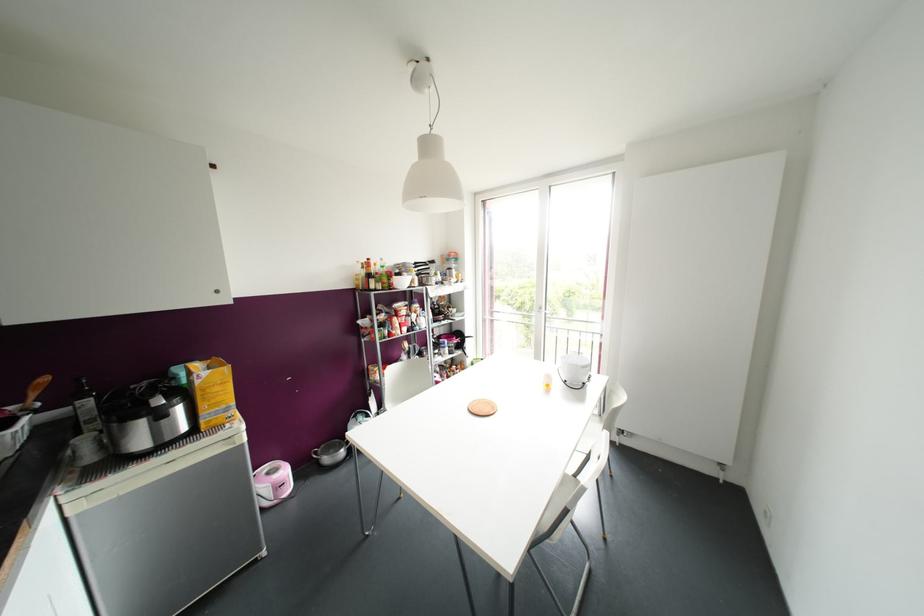
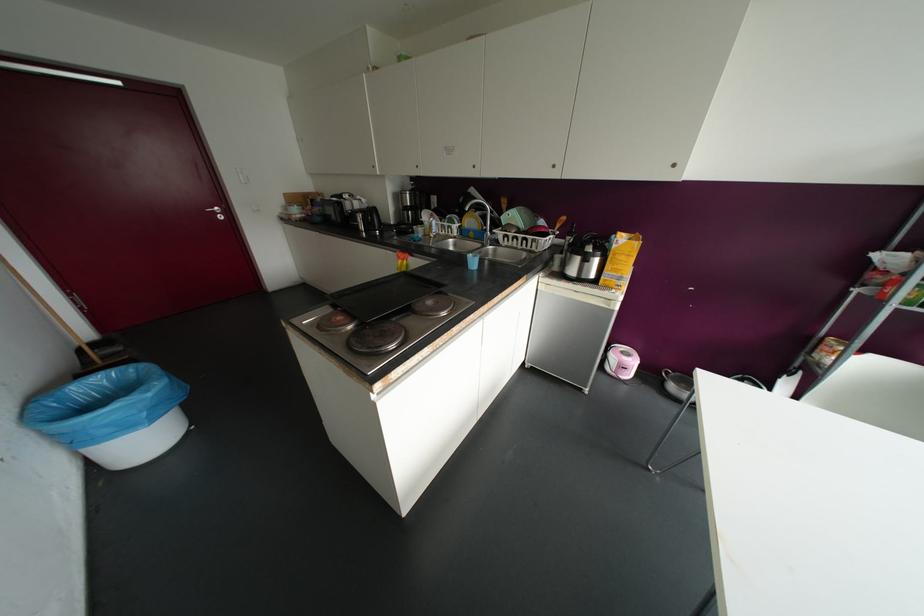
In the second image, find the point that corresponds to (216,291) in the first image.

(673, 164)